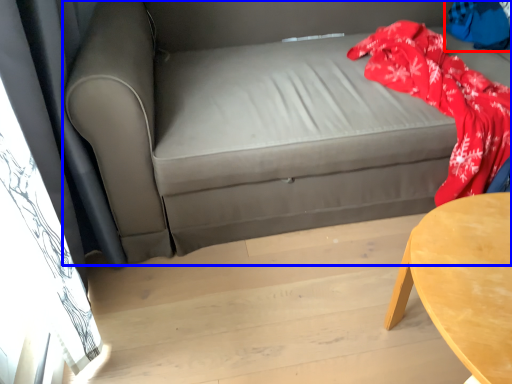
Question: Which object appears farthest to the camera in this image, clothing (highlighted by a red box) or studio couch (highlighted by a blue box)?

Choices:
 (A) clothing
 (B) studio couch

Answer: (A)